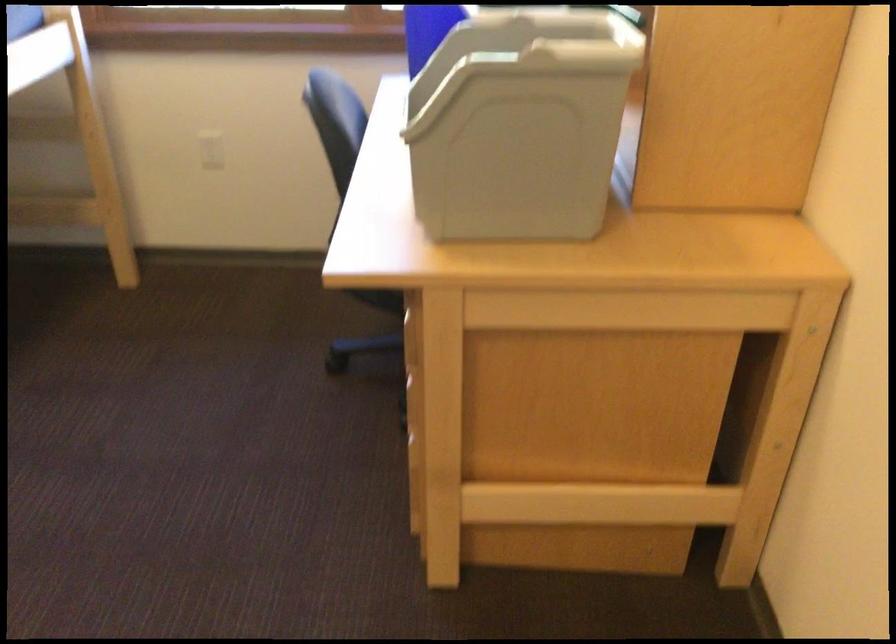
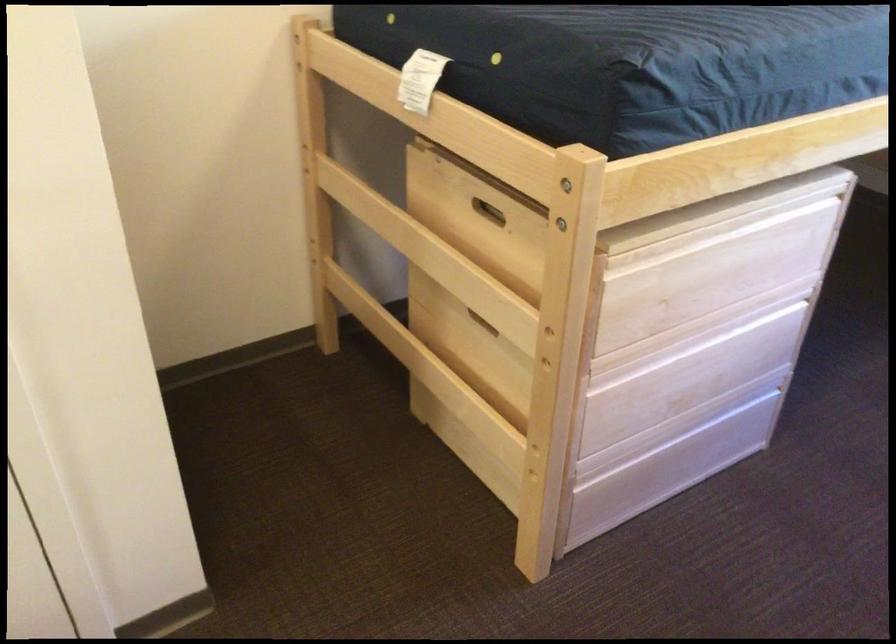
Question: The images are taken continuously from a first-person perspective. In which direction is your viewpoint rotating?

Choices:
 (A) Left
 (B) Right
 (C) Up
 (D) Down

Answer: (A)